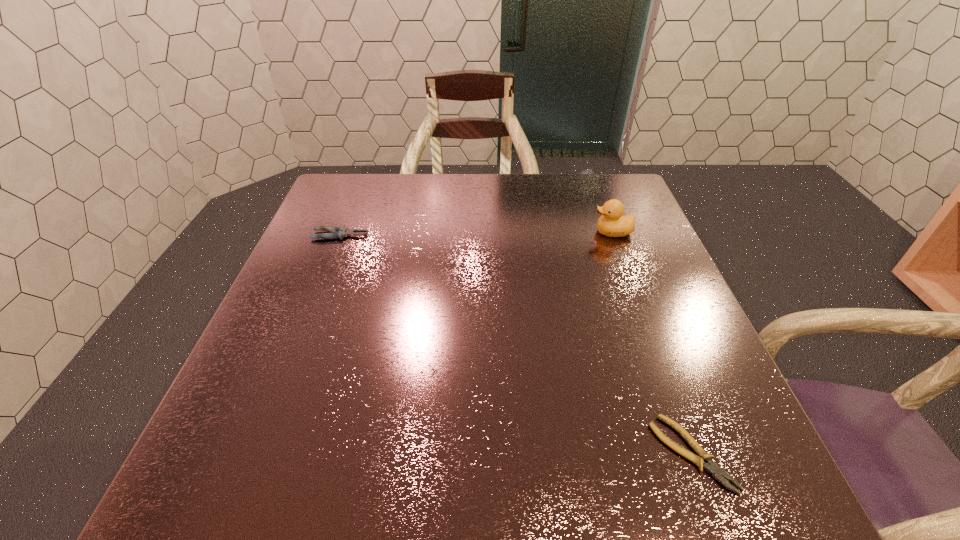
I want to click on the tallest object, so click(x=611, y=224).

Locate an element on the screen. The image size is (960, 540). the left pliers is located at coordinates (339, 232).

At what (x,y) coordinates should I click in order to perform the action: click on the second shortest object. Please return your answer as a coordinate pair (x, y). Looking at the image, I should click on (339, 232).

The height and width of the screenshot is (540, 960). What are the coordinates of `the right pliers` in the screenshot? It's located at click(717, 472).

Find the location of `the nearer pliers`. the nearer pliers is located at coordinates (717, 472).

At what (x,y) coordinates should I click in order to perform the action: click on free location located facing forward on the duckling. Please return your answer as a coordinate pair (x, y). The image size is (960, 540). Looking at the image, I should click on (542, 232).

This screenshot has height=540, width=960. Identify the location of free space located 0.270m facing forward on the duckling. (490, 232).

This screenshot has height=540, width=960. I want to click on vacant area situated 0.250m facing forward on the duckling, so click(x=497, y=232).

Locate an element on the screen. The image size is (960, 540). free spot located at the gripping part of the second shortest object is located at coordinates (398, 235).

Identify the location of blank area located on the left of the shorter pliers. (x=619, y=453).